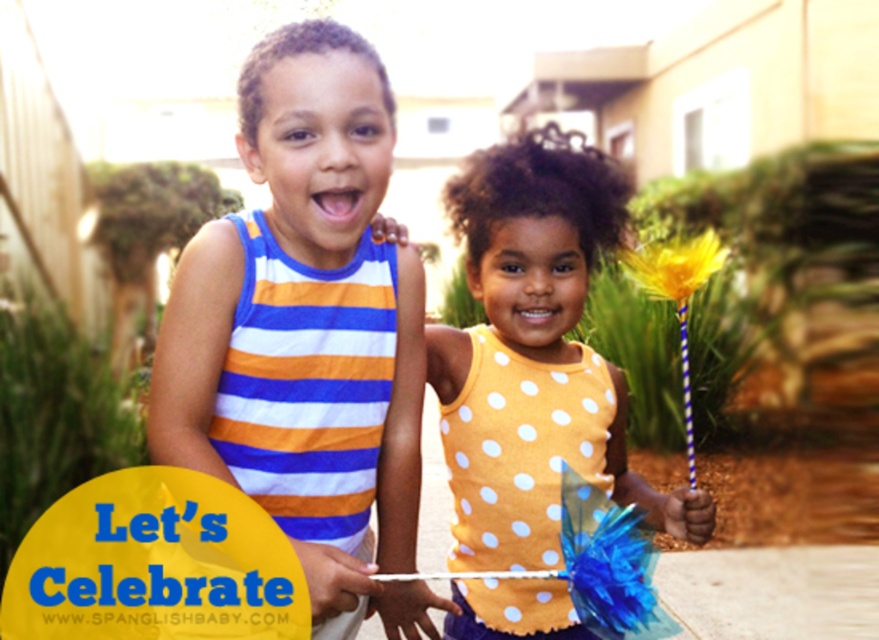
Does striped fabric tank top at left come in front of yellow paper flower at upper right?

Yes, it is in front of yellow paper flower at upper right.

What do you see at coordinates (307, 333) in the screenshot? The height and width of the screenshot is (640, 879). I see `striped fabric tank top at left` at bounding box center [307, 333].

Locate an element on the screen. This screenshot has height=640, width=879. striped fabric tank top at left is located at coordinates (307, 333).

Can you confirm if yellow dotted tank top at center is positioned below yellow paper flower at upper right?

Indeed, yellow dotted tank top at center is positioned under yellow paper flower at upper right.

Who is more distant from viewer, (447, 417) or (638, 284)?

Point (447, 417)

Who is more forward, (553, 609) or (696, 269)?

Point (696, 269) is more forward.

At what (x,y) coordinates should I click in order to perform the action: click on yellow dotted tank top at center. Please return your answer as a coordinate pair (x, y). Looking at the image, I should click on (535, 356).

Can you confirm if striped fabric tank top at left is positioned to the left of yellow dotted tank top at center?

Indeed, striped fabric tank top at left is positioned on the left side of yellow dotted tank top at center.

Is striped fabric tank top at left positioned at the back of yellow dotted tank top at center?

No, striped fabric tank top at left is in front of yellow dotted tank top at center.

Between point (237, 228) and point (589, 227), which one is positioned behind?

The point (589, 227) is behind.

What are the coordinates of `striped fabric tank top at left` in the screenshot? It's located at (307, 333).